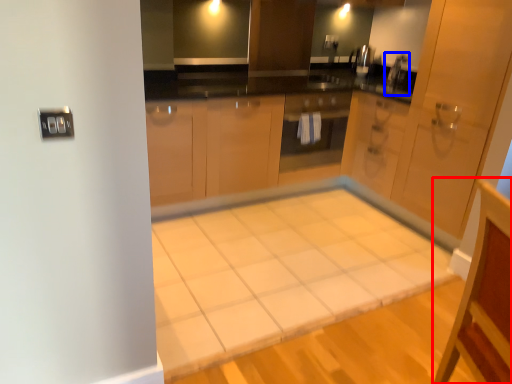
Question: Which object is further to the camera taking this photo, vanity (highlighted by a red box) or faucet (highlighted by a blue box)?

Choices:
 (A) vanity
 (B) faucet

Answer: (B)